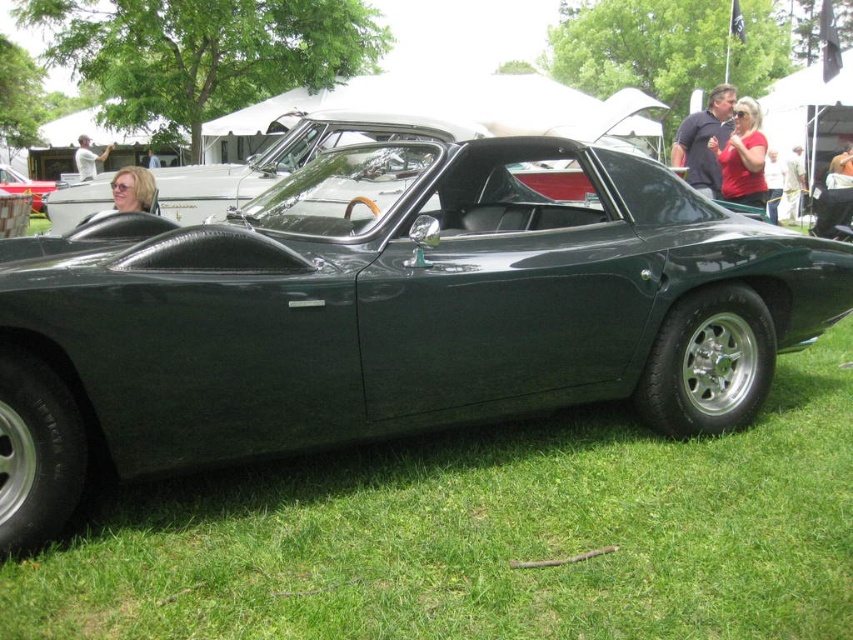
Question: Which of the following is the closest to the observer?

Choices:
 (A) green matte car at center
 (B) green matte sports car at center

Answer: (A)

Question: Can you confirm if green matte car at center is positioned to the right of matte red shirt at upper right?

Choices:
 (A) yes
 (B) no

Answer: (B)

Question: Can you confirm if green grass at lower center is positioned below matte blonde hair at center?

Choices:
 (A) no
 (B) yes

Answer: (B)

Question: Is green matte car at center positioned behind green matte sports car at center?

Choices:
 (A) yes
 (B) no

Answer: (B)

Question: Which object is positioned farthest from the denim pants at center?

Choices:
 (A) green matte car at center
 (B) blonde hair at center
 (C) matte black car at center

Answer: (B)

Question: Which is nearer to the light brown leather jacket at center?

Choices:
 (A) matte black car at center
 (B) green matte sports car at center
 (C) blonde hair at center

Answer: (A)